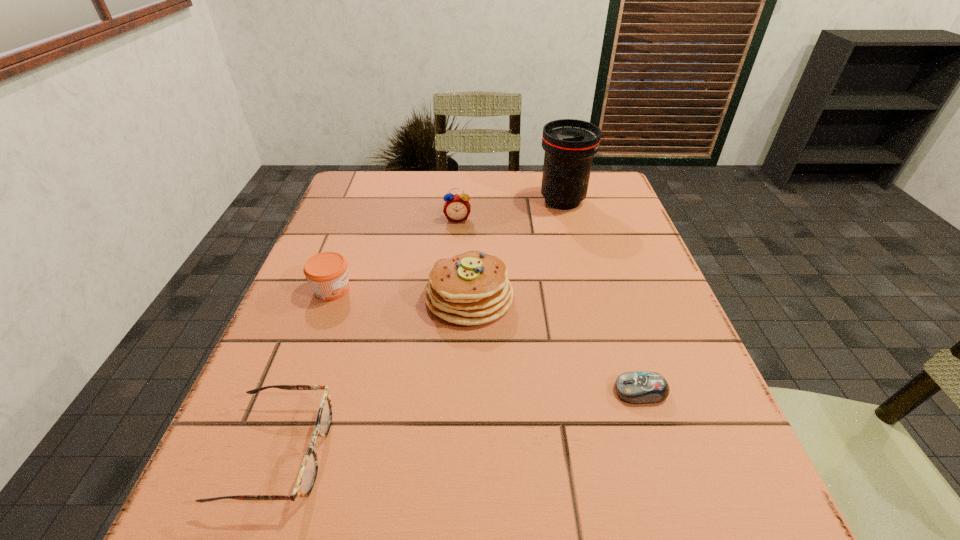
You are a GUI agent. You are given a task and a screenshot of the screen. Output one action in this format:
    pyautogui.click(x=<x>, y=<y>)
    Task: Click on the empty space that is in between the spectacles and the jam
    Image resolution: width=960 pixels, height=540 pixels.
    Given the screenshot: What is the action you would take?
    pyautogui.click(x=305, y=372)

Identify the location of unoccupied position between the telephoto lens and the second shortest object. The height and width of the screenshot is (540, 960). (420, 327).

Where is `vacant area that lies between the second shortest object and the telephoto lens`? The image size is (960, 540). vacant area that lies between the second shortest object and the telephoto lens is located at coordinates (420, 327).

The image size is (960, 540). Identify the location of free area in between the computer mouse and the pancake. (555, 344).

At what (x,y) coordinates should I click in order to perform the action: click on vacant area that lies between the alarm clock and the spectacles. Please return your answer as a coordinate pair (x, y). This screenshot has height=540, width=960. Looking at the image, I should click on (368, 336).

The image size is (960, 540). I want to click on empty location between the shortest object and the alarm clock, so [549, 305].

Where is `free space between the alarm clock and the fourth tallest object`? The height and width of the screenshot is (540, 960). free space between the alarm clock and the fourth tallest object is located at coordinates (395, 254).

Locate which object is the closest to the telephoto lens. Please provide its 2D coordinates. Your answer should be formatted as a tuple, i.e. [(x, y)], where the tuple contains the x and y coordinates of a point satisfying the conditions above.

[(457, 208)]

Select which object is the second closest to the pancake. Please provide its 2D coordinates. Your answer should be formatted as a tuple, i.e. [(x, y)], where the tuple contains the x and y coordinates of a point satisfying the conditions above.

[(457, 208)]

At what (x,y) coordinates should I click in order to perform the action: click on free location that satisfies the following two spatial constraints: 1. on the front side of the telephoto lens; 2. on the front label of the jam. Please return your answer as a coordinate pair (x, y). Image resolution: width=960 pixels, height=540 pixels. Looking at the image, I should click on (587, 289).